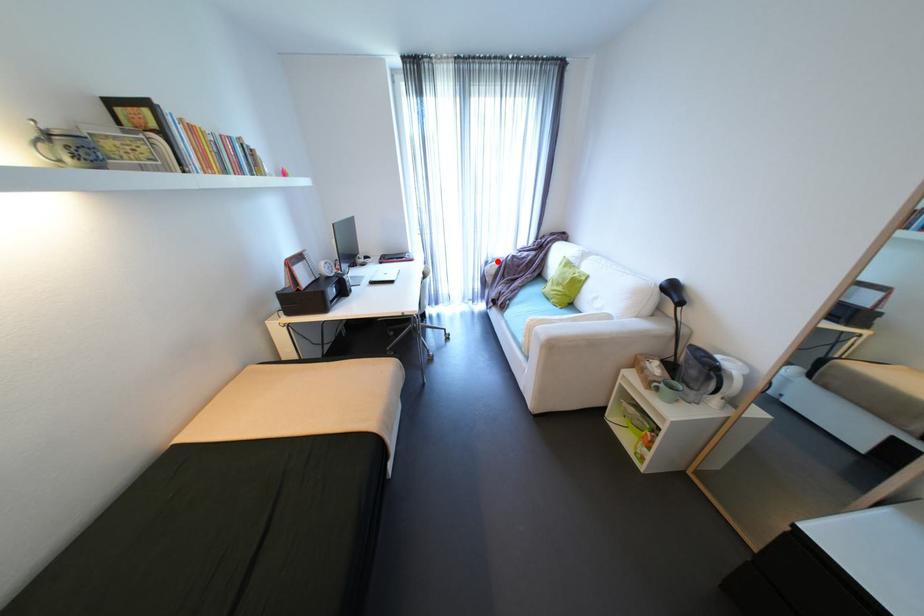
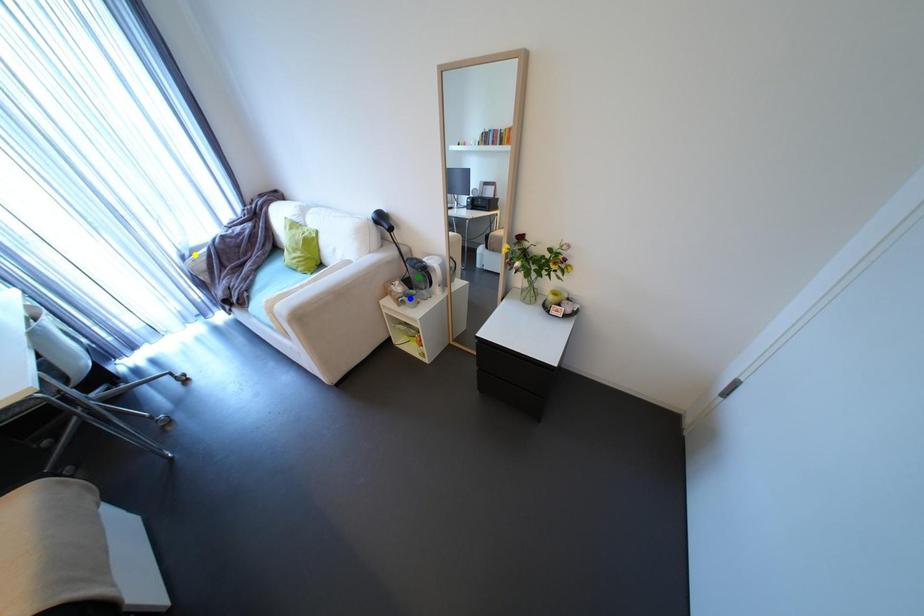
Question: I am providing you with two images of the same scene from different viewpoints. A red point is marked on the first image. You are given multiple points on the second image. Which point in image 2 represents the same 3d spot as the red point in image 1?

Choices:
 (A) yellow point
 (B) green point
 (C) blue point

Answer: (A)